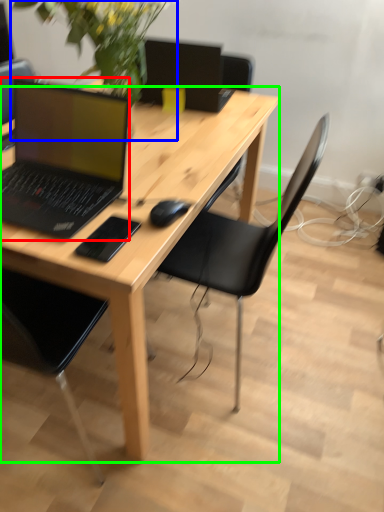
Question: Which object is the farthest from laptop (highlighted by a red box)? Choose among these: floral arrangement (highlighted by a blue box) or desk (highlighted by a green box).

Choices:
 (A) floral arrangement
 (B) desk

Answer: (A)